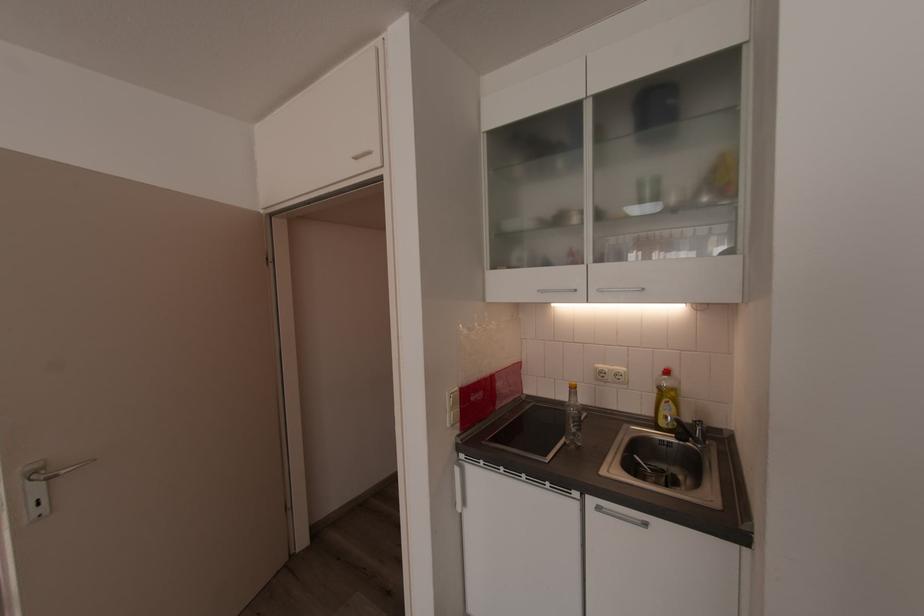
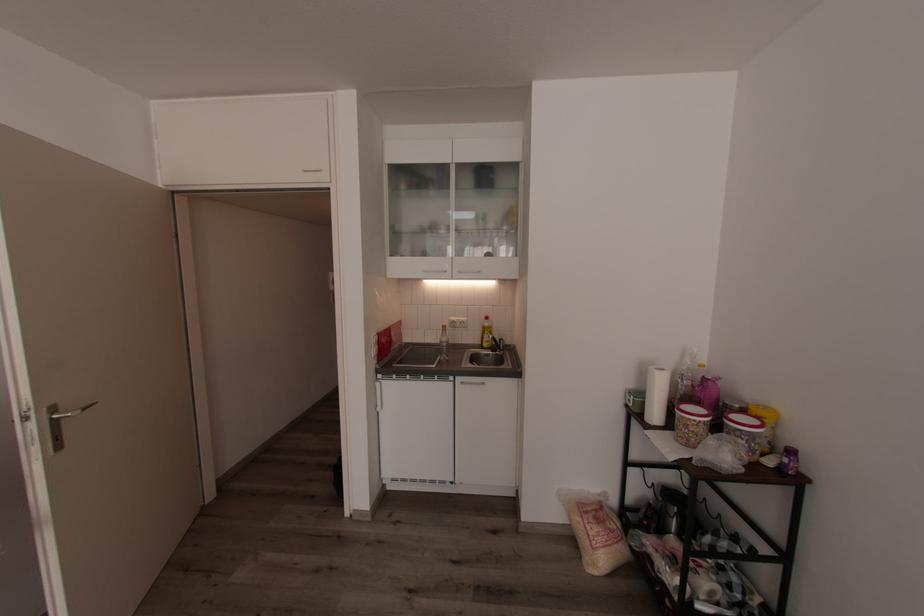
The point at (579, 493) is marked in the first image. Where is the corresponding point in the second image?

(456, 378)